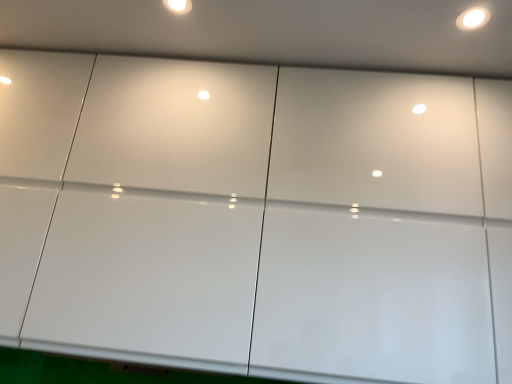
Question: Would you say white glossy light at upper right is a long distance from white glossy light fixture at upper center?

Choices:
 (A) no
 (B) yes

Answer: (A)

Question: From the image's perspective, would you say white glossy light at upper right is positioned over white glossy light fixture at upper center?

Choices:
 (A) yes
 (B) no

Answer: (B)

Question: Is white glossy light at upper right at the right side of white glossy light fixture at upper center?

Choices:
 (A) yes
 (B) no

Answer: (A)

Question: Does white glossy light at upper right have a smaller size compared to white glossy light fixture at upper center?

Choices:
 (A) no
 (B) yes

Answer: (A)

Question: From a real-world perspective, is white glossy light at upper right located higher than white glossy light fixture at upper center?

Choices:
 (A) yes
 (B) no

Answer: (B)

Question: Is white glossy light at upper right looking in the opposite direction of white glossy light fixture at upper center?

Choices:
 (A) yes
 (B) no

Answer: (B)

Question: From a real-world perspective, does white glossy light fixture at upper center sit lower than white glossy light at upper right?

Choices:
 (A) yes
 (B) no

Answer: (B)

Question: From the image's perspective, is white glossy light fixture at upper center on white glossy light at upper right?

Choices:
 (A) no
 (B) yes

Answer: (B)

Question: From a real-world perspective, is white glossy light fixture at upper center located higher than white glossy light at upper right?

Choices:
 (A) yes
 (B) no

Answer: (A)

Question: From the image's perspective, is white glossy light fixture at upper center under white glossy light at upper right?

Choices:
 (A) yes
 (B) no

Answer: (B)

Question: Is white glossy light fixture at upper center aimed at white glossy light at upper right?

Choices:
 (A) yes
 (B) no

Answer: (B)

Question: Is white glossy light fixture at upper center bigger than white glossy light at upper right?

Choices:
 (A) no
 (B) yes

Answer: (A)

Question: Is white glossy light fixture at upper center in front of or behind white glossy light at upper right in the image?

Choices:
 (A) front
 (B) behind

Answer: (B)